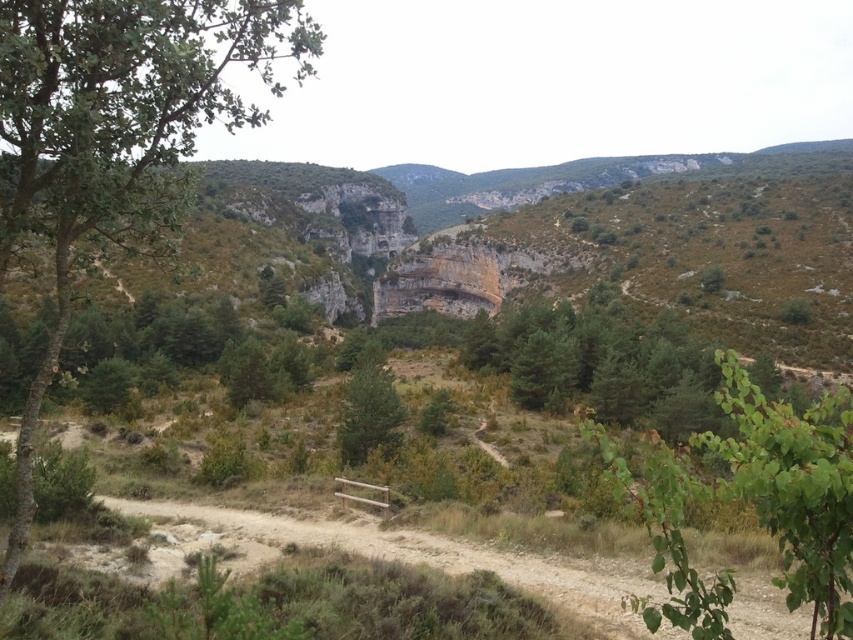
Question: Which point is farther to the camera?

Choices:
 (A) green matte tree at center
 (B) green leafy tree at left

Answer: (A)

Question: Estimate the real-world distances between objects in this image. Which object is farther from the green matte tree at center?

Choices:
 (A) green leafy branch at lower right
 (B) green leafy tree at left

Answer: (B)

Question: Among these points, which one is farthest from the camera?

Choices:
 (A) (357, 456)
 (B) (677, 486)
 (C) (28, 513)

Answer: (A)

Question: Can you confirm if green leafy tree at left is positioned below green leafy branch at lower right?

Choices:
 (A) yes
 (B) no

Answer: (B)

Question: Can you confirm if green leafy tree at left is positioned above green leafy branch at lower right?

Choices:
 (A) yes
 (B) no

Answer: (A)

Question: Can you confirm if green leafy tree at left is thinner than green matte tree at center?

Choices:
 (A) no
 (B) yes

Answer: (A)